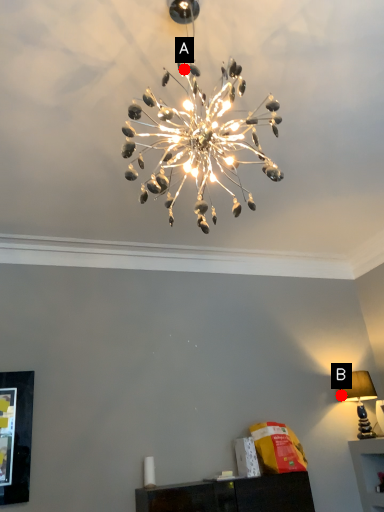
Question: Two points are circled on the image, labeled by A and B beside each circle. Which point is farther from the camera taking this photo?

Choices:
 (A) A is further
 (B) B is further

Answer: (B)